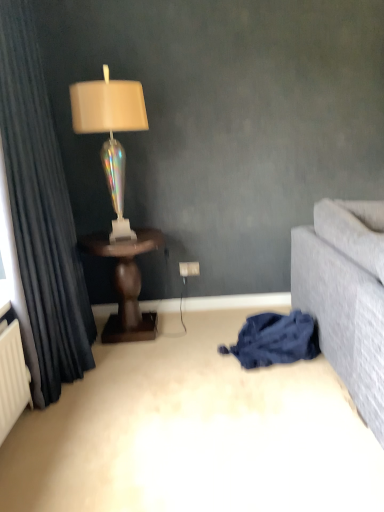
Question: Does point (132, 292) appear closer or farther from the camera than point (246, 317)?

Choices:
 (A) farther
 (B) closer

Answer: (A)

Question: Which is correct: dark wood table at left is inside blue cotton blanket at lower right, or outside of it?

Choices:
 (A) inside
 (B) outside

Answer: (B)

Question: Which of these objects is positioned closest to the white matte carpet at center?

Choices:
 (A) blue cotton blanket at lower right
 (B) dark grey velvet curtain at left
 (C) dark wood table at left
 (D) iridescent glass lamp at left

Answer: (A)

Question: Which of these objects is positioned closest to the dark grey velvet curtain at left?

Choices:
 (A) dark wood table at left
 (B) blue cotton blanket at lower right
 (C) iridescent glass lamp at left
 (D) white matte carpet at center

Answer: (C)